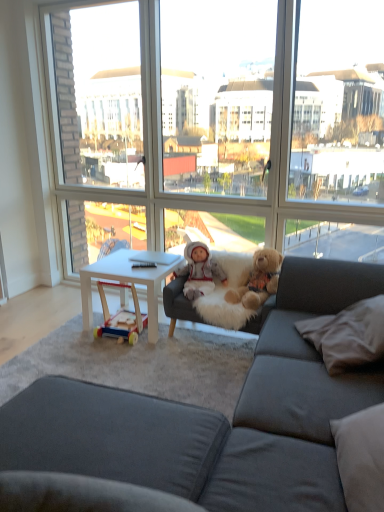
The image size is (384, 512). Identify the location of white matte table at center. (127, 283).

What is the approximate width of fluffy brown teddy bear at center?

fluffy brown teddy bear at center is 16.60 inches wide.

The image size is (384, 512). What do you see at coordinates (170, 160) in the screenshot?
I see `transparent glass window at center` at bounding box center [170, 160].

This screenshot has height=512, width=384. I want to click on white soft pillow at lower right, so click(348, 335).

Locate an element on the screen. This screenshot has height=512, width=384. dark gray fabric couch at center is located at coordinates (200, 424).

Which of these two, transparent glass window at center or white soft pillow at lower right, stands taller?

transparent glass window at center.

Is transparent glass window at center bigger than white soft pillow at lower right?

Indeed, transparent glass window at center has a larger size compared to white soft pillow at lower right.

How different are the orientations of transparent glass window at center and white soft pillow at lower right in degrees?

There is a 63.8-degree angle between the facing directions of transparent glass window at center and white soft pillow at lower right.

Does dark gray fabric couch at center touch white plush doll at center?

No, dark gray fabric couch at center is not next to white plush doll at center.

Which is more to the left, dark gray fabric couch at center or white plush doll at center?

From the viewer's perspective, white plush doll at center appears more on the left side.

From the image's perspective, is dark gray fabric couch at center above or below white plush doll at center?

Based on their image positions, dark gray fabric couch at center is located beneath white plush doll at center.

Does white matte table at center have a greater height compared to white plush doll at center?

Yes, white matte table at center is taller than white plush doll at center.

I want to click on desk below the white plush doll at center (from the image's perspective), so click(x=127, y=283).

From a real-world perspective, is white matte table at center on white plush doll at center?

Actually, white matte table at center is physically below white plush doll at center in the real world.

Is white matte table at center facing towards white plush doll at center?

No, white matte table at center is not turned towards white plush doll at center.

From the image's perspective, which object appears higher, dark gray fabric couch at center or white soft pillow at lower right?

From the image's view, white soft pillow at lower right is above.

Is dark gray fabric couch at center with white soft pillow at lower right?

No, dark gray fabric couch at center is not in contact with white soft pillow at lower right.

What's the angular difference between dark gray fabric couch at center and white soft pillow at lower right's facing directions?

The facing directions of dark gray fabric couch at center and white soft pillow at lower right are 20.5 degrees apart.

Looking at this image, measure the distance from dark gray fabric couch at center to white soft pillow at lower right.

The distance of dark gray fabric couch at center from white soft pillow at lower right is 13.13 inches.

Do you think transparent glass window at center is within fluffy brown teddy bear at center, or outside of it?

The correct answer is: outside.

Is transparent glass window at center not near fluffy brown teddy bear at center?

No, transparent glass window at center is not far from fluffy brown teddy bear at center.

Is white soft pillow at lower right bigger than white matte table at center?

No, white soft pillow at lower right is not bigger than white matte table at center.

Is the depth of white soft pillow at lower right less than that of white matte table at center?

Yes, white soft pillow at lower right is in front of white matte table at center.

Considering the sizes of objects white soft pillow at lower right and white matte table at center in the image provided, who is taller, white soft pillow at lower right or white matte table at center?

Standing taller between the two is white matte table at center.

Considering the points (335, 348) and (88, 294), which point is behind, point (335, 348) or point (88, 294)?

The point (88, 294) is behind.

Image resolution: width=384 pixels, height=512 pixels. Find the location of `desk below the fluffy brown teddy bear at center (from the image's perspective)`. desk below the fluffy brown teddy bear at center (from the image's perspective) is located at coordinates (127, 283).

Is white matte table at center located within fluffy brown teddy bear at center?

No, white matte table at center is not a part of fluffy brown teddy bear at center.

From a real-world perspective, between fluffy brown teddy bear at center and white matte table at center, who is vertically higher?

From a 3D spatial view, fluffy brown teddy bear at center is above.

Considering the sizes of fluffy brown teddy bear at center and white matte table at center in the image, is fluffy brown teddy bear at center taller or shorter than white matte table at center?

fluffy brown teddy bear at center is shorter than white matte table at center.

In the image, there is a white soft pillow at lower right. Where is `window above it (from the image's perspective)`? The image size is (384, 512). window above it (from the image's perspective) is located at coordinates (170, 160).

This screenshot has width=384, height=512. In order to click on person behind the dark gray fabric couch at center in this screenshot , I will do point(199,271).

Looking at the image, which one is located closer to white soft pillow at lower right, white matte table at center or fluffy brown teddy bear at center?

Among the two, fluffy brown teddy bear at center is located nearer to white soft pillow at lower right.

Which object lies further to the anchor point transparent glass window at center, white soft pillow at lower right or dark gray fabric couch at center?

Among the two, dark gray fabric couch at center is located further to transparent glass window at center.

Which object lies further to the anchor point white plush doll at center, white matte table at center or fluffy brown teddy bear at center?

white matte table at center is positioned further to the anchor white plush doll at center.

In the scene shown: Looking at the image, which one is located closer to transparent glass window at center, white soft pillow at lower right or white matte table at center?

white matte table at center is closer to transparent glass window at center.

Estimate the real-world distances between objects in this image. Which object is closer to dark gray fabric couch at center, white matte table at center or transparent glass window at center?

Among the two, white matte table at center is located nearer to dark gray fabric couch at center.

When comparing their distances from dark gray fabric couch at center, does fluffy brown teddy bear at center or white soft pillow at lower right seem closer?

The object closer to dark gray fabric couch at center is white soft pillow at lower right.

When comparing their distances from dark gray fabric couch at center, does white soft pillow at lower right or transparent glass window at center seem further?

transparent glass window at center lies further to dark gray fabric couch at center than the other object.

From the image, which object appears to be farther from fluffy brown teddy bear at center, white plush doll at center or white matte table at center?

white matte table at center is further to fluffy brown teddy bear at center.

At what (x,y) coordinates should I click in order to perform the action: click on teddy bear positioned between white soft pillow at lower right and white plush doll at center from near to far. Please return your answer as a coordinate pair (x, y). Looking at the image, I should click on (258, 280).

At what (x,y) coordinates should I click in order to perform the action: click on person between transparent glass window at center and white matte table at center in the up-down direction. Please return your answer as a coordinate pair (x, y). Looking at the image, I should click on (199, 271).

At what (x,y) coordinates should I click in order to perform the action: click on pillow between dark gray fabric couch at center and transparent glass window at center along the z-axis. Please return your answer as a coordinate pair (x, y). The image size is (384, 512). Looking at the image, I should click on (348, 335).

The width and height of the screenshot is (384, 512). Find the location of `window between white matte table at center and white soft pillow at lower right`. window between white matte table at center and white soft pillow at lower right is located at coordinates (170, 160).